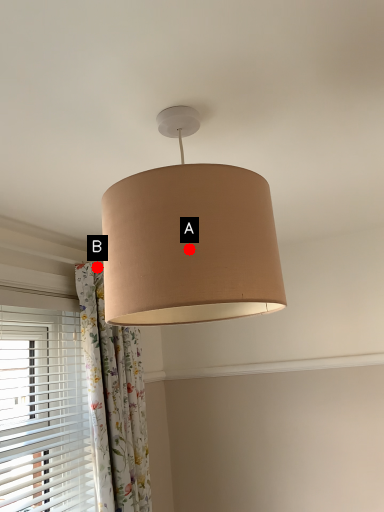
Question: Two points are circled on the image, labeled by A and B beside each circle. Among these points, which one is nearest to the camera?

Choices:
 (A) A is closer
 (B) B is closer

Answer: (A)